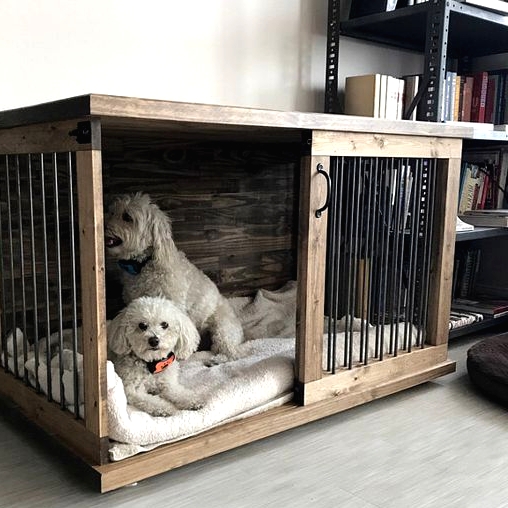
Find the location of a particular element. blanket is located at coordinates (257, 369), (130, 426), (277, 302).